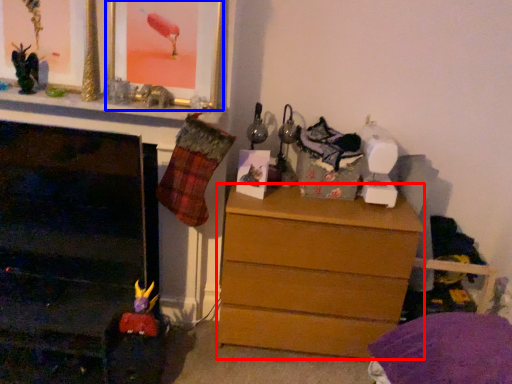
Question: Which object appears closest to the camera in this image, chest of drawers (highlighted by a red box) or picture frame (highlighted by a blue box)?

Choices:
 (A) chest of drawers
 (B) picture frame

Answer: (B)